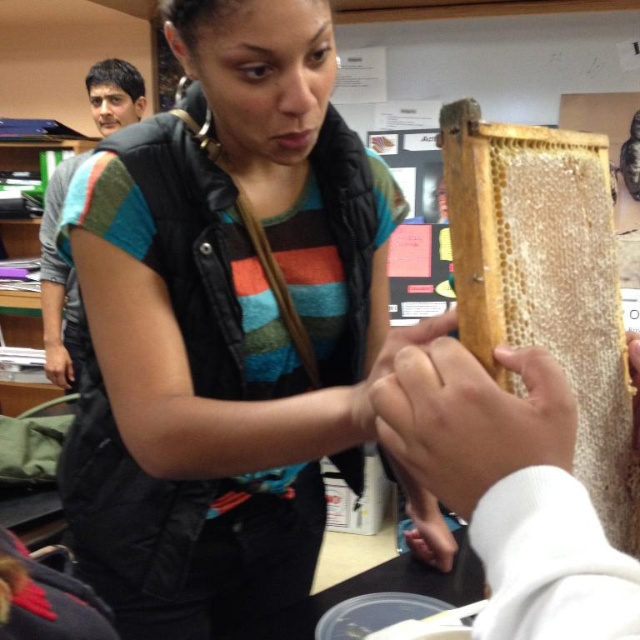
Describe the element at coordinates (545, 280) in the screenshot. I see `natural honeycomb at upper right` at that location.

Can you confirm if natural honeycomb at upper right is wider than smooth skin at center?

Indeed, natural honeycomb at upper right has a greater width compared to smooth skin at center.

Locate an element on the screen. The height and width of the screenshot is (640, 640). natural honeycomb at upper right is located at coordinates (545, 280).

The width and height of the screenshot is (640, 640). I want to click on natural honeycomb at upper right, so click(545, 280).

Which of these two, matte black vest at center or smooth skin at center, stands shorter?

With less height is smooth skin at center.

Which is in front, point (296, 419) or point (483, 456)?

Positioned in front is point (483, 456).

At what (x,y) coordinates should I click in order to perform the action: click on matte black vest at center. Please return your answer as a coordinate pair (x, y). The width and height of the screenshot is (640, 640). Looking at the image, I should click on (224, 324).

Between matte black vest at center and natural honeycomb at upper right, which one appears on the left side from the viewer's perspective?

Positioned to the left is matte black vest at center.

Can you confirm if matte black vest at center is wider than natural honeycomb at upper right?

Yes, matte black vest at center is wider than natural honeycomb at upper right.

Consider the image. Measure the distance between matte black vest at center and camera.

matte black vest at center and camera are 51.36 centimeters apart from each other.

Where is `matte black vest at center`? The height and width of the screenshot is (640, 640). matte black vest at center is located at coordinates (224, 324).